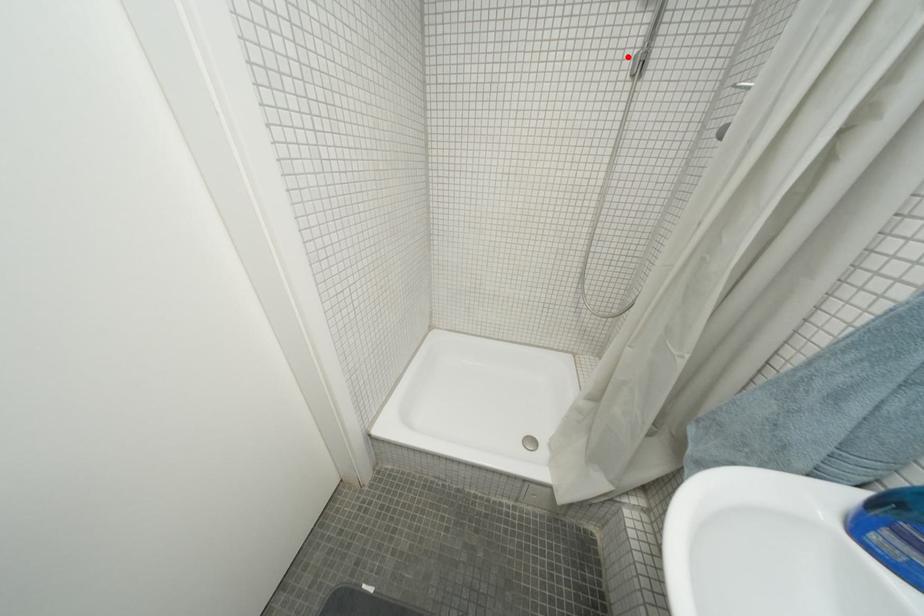
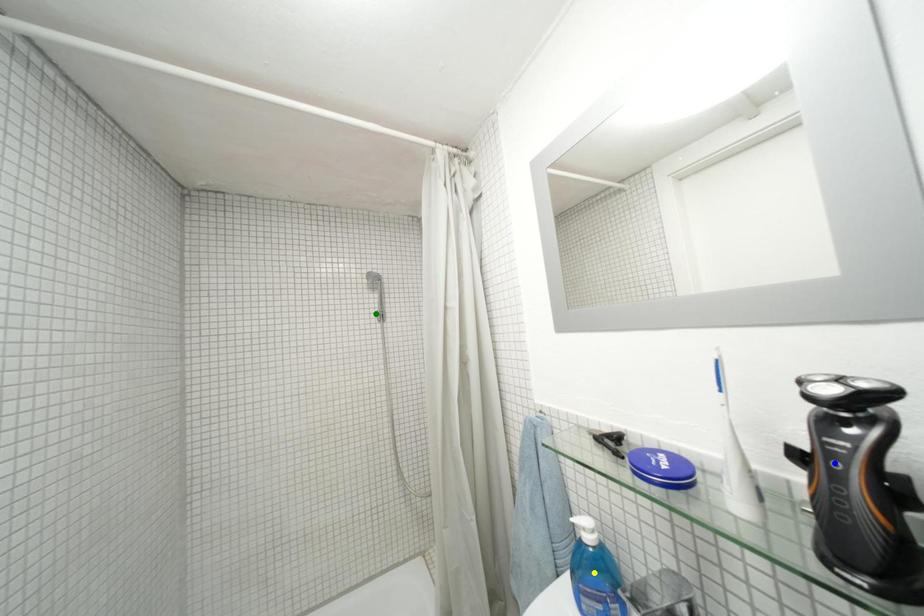
Question: I am providing you with two images of the same scene from different viewpoints. A red point is marked on the first image. You are given multiple points on the second image. In image 2, which mark is for the same physical point as the one in image 1?

Choices:
 (A) green point
 (B) yellow point
 (C) blue point

Answer: (A)